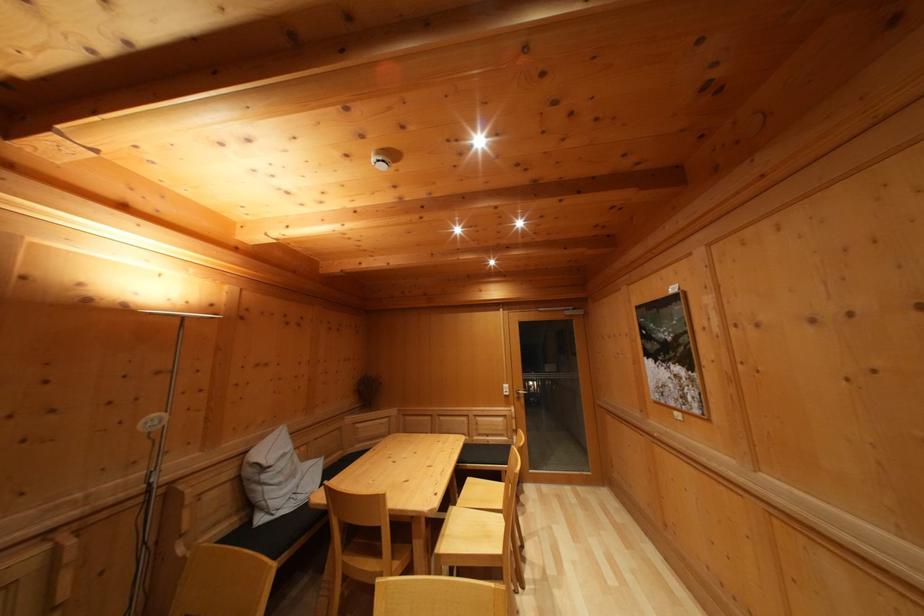
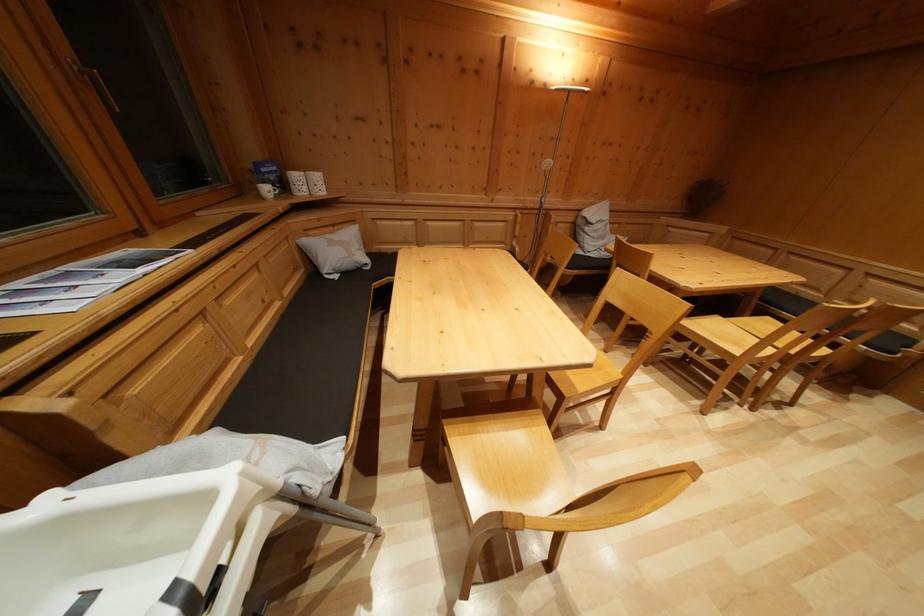
Locate, in the second image, the point that corresponds to point (494, 543) in the first image.

(743, 352)